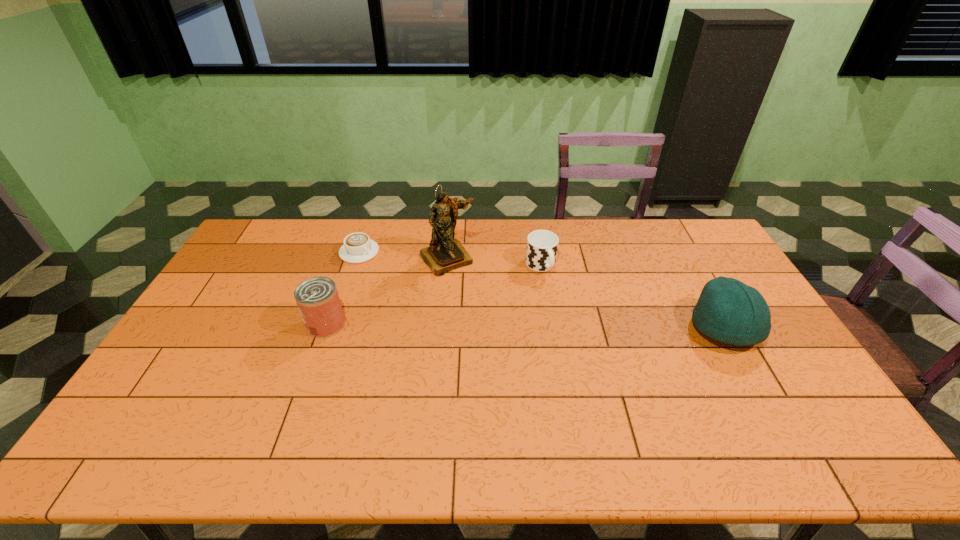
What are the coordinates of `cappuccino that is at the far edge` in the screenshot? It's located at (358, 248).

I want to click on object situated at the right edge, so click(727, 310).

Find the location of `vacant region at the far edge`. vacant region at the far edge is located at coordinates (383, 234).

Identify the location of blank space at the near edge. The height and width of the screenshot is (540, 960). (526, 418).

Image resolution: width=960 pixels, height=540 pixels. I want to click on vacant space at the left edge of the desktop, so (x=221, y=352).

Where is `free region at the right edge of the desktop`? free region at the right edge of the desktop is located at coordinates (774, 375).

Locate an element on the screen. The image size is (960, 540). vacant space at the far left corner of the desktop is located at coordinates (288, 241).

Image resolution: width=960 pixels, height=540 pixels. What are the coordinates of `blank region between the beanie and the figurine` in the screenshot? It's located at (586, 294).

The width and height of the screenshot is (960, 540). What are the coordinates of `empty space between the cappuccino and the can` in the screenshot? It's located at (343, 288).

In order to click on free space between the fourth object from left to right and the tallest object in this screenshot , I will do `click(494, 262)`.